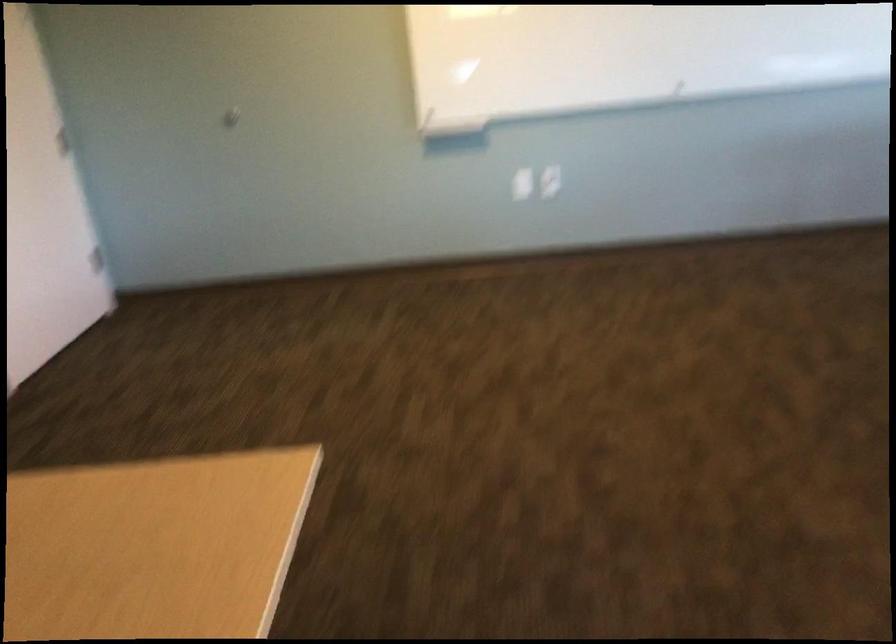
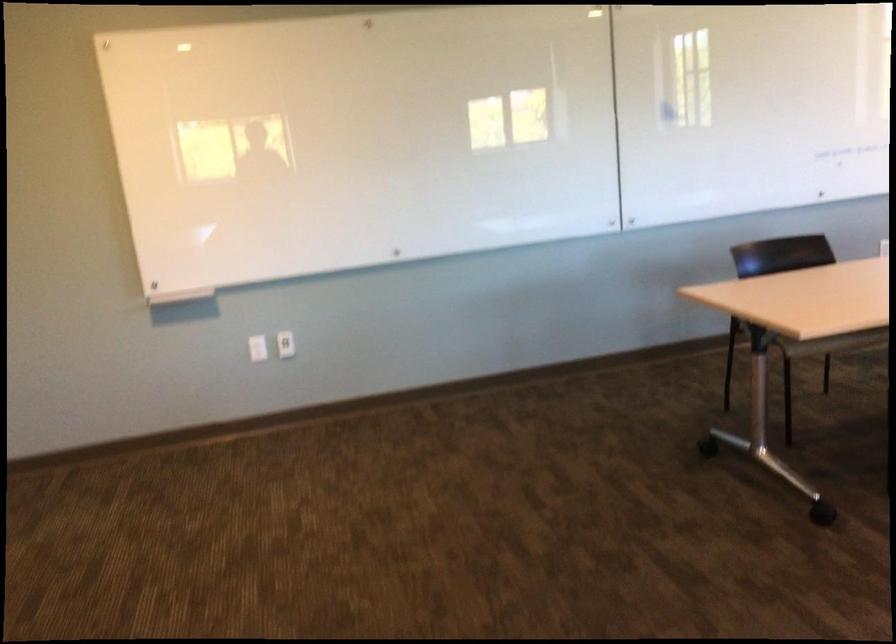
Find the pixel in the second image that matches [519,185] in the first image.

(256, 348)